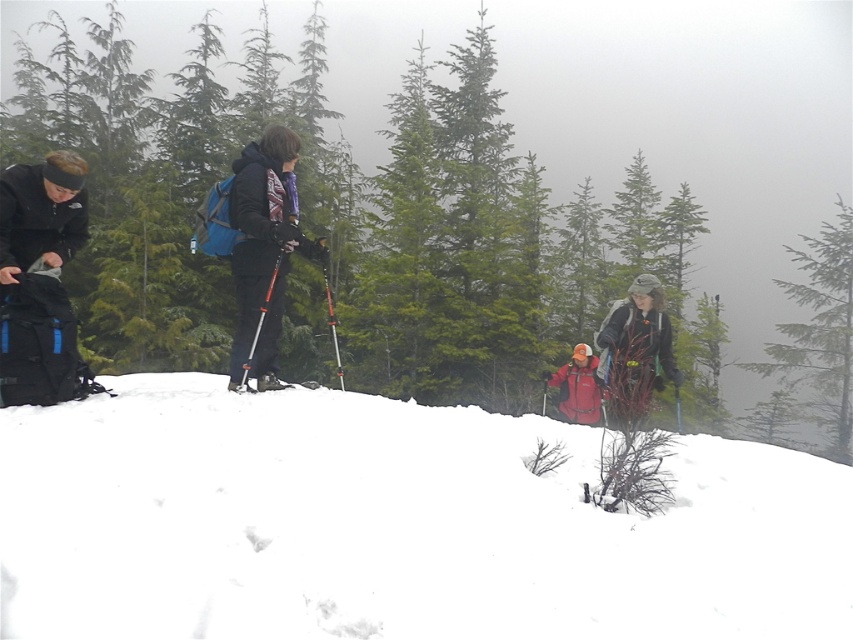
You are a hiker preparing for a winter trek. You see the white snow at lower left and the matte black ski at center. Which object is located to the right of the other?

The white snow at lower left is positioned on the right side of matte black ski at center, so the white snow at lower left is to the right of the matte black ski at center.

You are standing at the point marked by the coordinates point (263, 248) in the snowy forest scene. What object is located exactly at that point?

The point (263, 248) corresponds to the matte black jacket at center, so the object at that point is the matte black jacket at center.